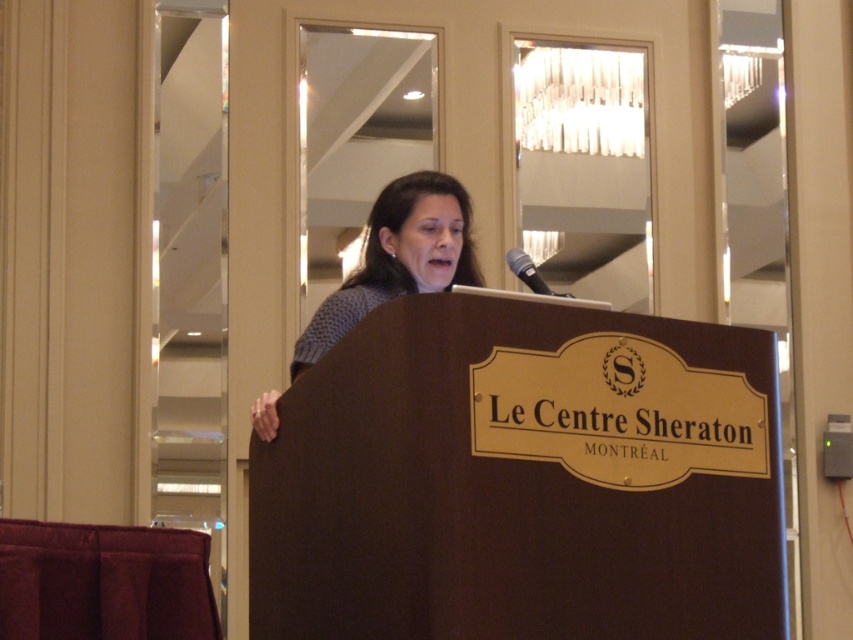
Question: Which of the following is the closest to the observer?

Choices:
 (A) black metallic microphone at upper center
 (B) knitted sweater at center

Answer: (A)

Question: Is knitted sweater at center positioned at the back of black metallic microphone at upper center?

Choices:
 (A) yes
 (B) no

Answer: (A)

Question: Considering the relative positions of knitted sweater at center and black metallic microphone at upper center in the image provided, where is knitted sweater at center located with respect to black metallic microphone at upper center?

Choices:
 (A) right
 (B) left

Answer: (B)

Question: Which of the following is the closest to the observer?

Choices:
 (A) black metallic microphone at upper center
 (B) knitted sweater at center

Answer: (A)

Question: Is knitted sweater at center thinner than black metallic microphone at upper center?

Choices:
 (A) no
 (B) yes

Answer: (A)

Question: Which point is closer to the camera?

Choices:
 (A) black metallic microphone at upper center
 (B) knitted sweater at center

Answer: (A)